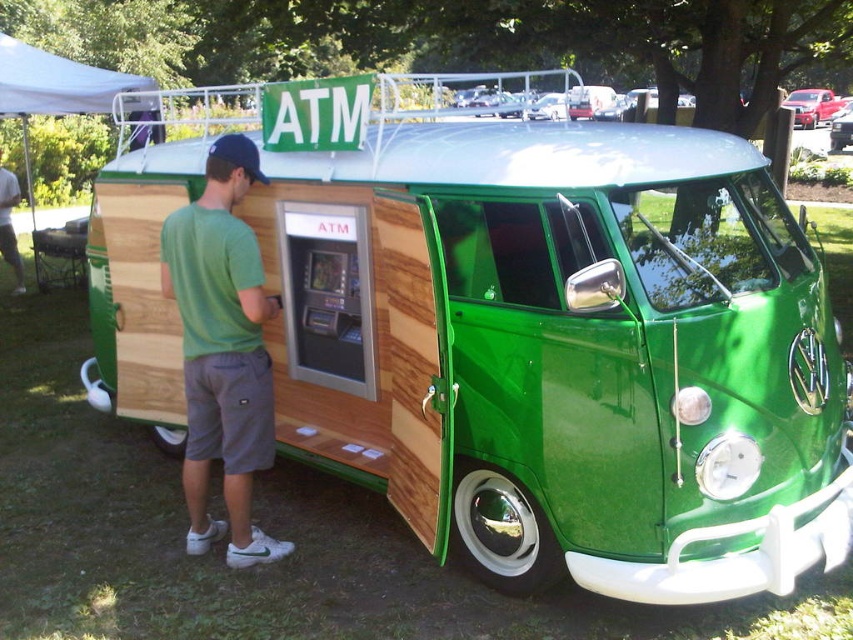
From the picture: Which is above, white fabric canopy at upper left or shiny red car at upper right?

shiny red car at upper right

Is white fabric canopy at upper left above shiny red car at upper right?

No, white fabric canopy at upper left is not above shiny red car at upper right.

Locate an element on the screen. Image resolution: width=853 pixels, height=640 pixels. white fabric canopy at upper left is located at coordinates (62, 84).

Which is behind, point (10, 61) or point (836, 129)?

Positioned behind is point (836, 129).

You are a GUI agent. You are given a task and a screenshot of the screen. Output one action in this format:
    pyautogui.click(x=<x>, y=<y>)
    Task: Click on the white fabric canopy at upper left
    This screenshot has width=853, height=640.
    Given the screenshot: What is the action you would take?
    pyautogui.click(x=62, y=84)

Who is taller, green matte shirt at left or green matte shorts at lower left?

green matte shirt at left is taller.

Does point (250, 236) come farther from viewer compared to point (22, 289)?

No, (250, 236) is closer to viewer.

I want to click on green matte shirt at left, so click(x=222, y=349).